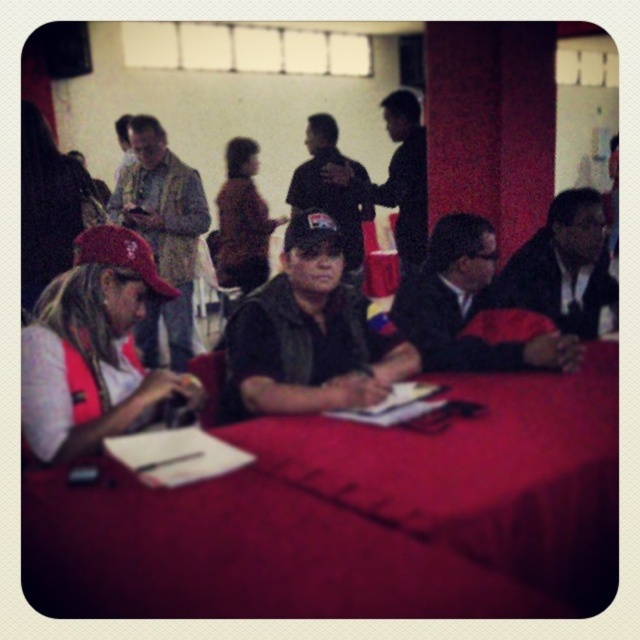
Question: Based on their relative distances, which object is nearer to the dark blue fabric cap at center?

Choices:
 (A) matte yellow vest at left
 (B) dark blue shirt at center

Answer: (B)

Question: Which of the following is the farthest from the observer?

Choices:
 (A) (349, 260)
 (B) (458, 241)
 (C) (256, 170)
 (D) (346, 323)

Answer: (C)

Question: Can you confirm if black suit at right is thinner than dark blue fabric cap at center?

Choices:
 (A) yes
 (B) no

Answer: (A)

Question: Can you confirm if black suit at right is smaller than dark blue fabric cap at center?

Choices:
 (A) yes
 (B) no

Answer: (A)

Question: Considering the relative positions of black suit at right and dark blue fabric cap at center in the image provided, where is black suit at right located with respect to dark blue fabric cap at center?

Choices:
 (A) above
 (B) below

Answer: (B)

Question: Which of the following is the closest to the observer?

Choices:
 (A) (406, 138)
 (B) (40, 332)

Answer: (B)